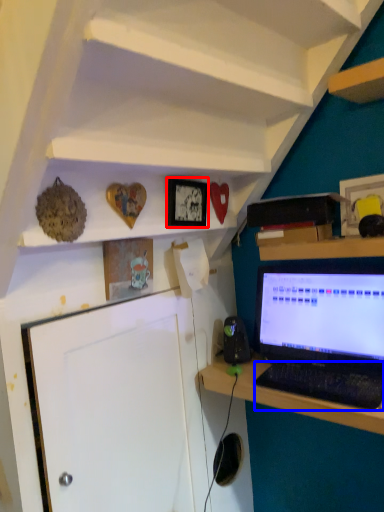
Question: Among these objects, which one is nearest to the camera, picture frame (highlighted by a red box) or computer keyboard (highlighted by a blue box)?

Choices:
 (A) picture frame
 (B) computer keyboard

Answer: (B)